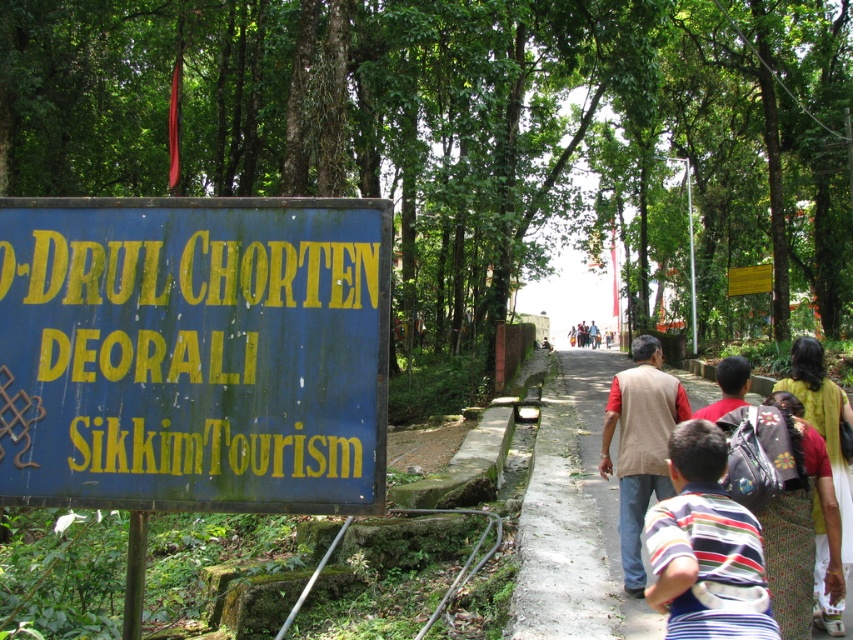
Measure the distance between point (281,436) and camera.

Point (281,436) and camera are 2.80 meters apart.

Between blue painted signboard at left and beige cotton vest at center, which one is positioned higher?

Positioned higher is blue painted signboard at left.

This screenshot has height=640, width=853. In order to click on blue painted signboard at left in this screenshot , I will do `click(193, 353)`.

Is the position of concrete at center more distant than that of yellow cotton saree at right?

Yes, it is.

Does point (520, 596) lie behind point (817, 545)?

Yes.

Locate an element on the screen. The height and width of the screenshot is (640, 853). concrete at center is located at coordinates (573, 516).

Is yellow cotton saree at right positioned behind light blue shirt at center?

No, yellow cotton saree at right is in front of light blue shirt at center.

Is yellow cotton saree at right below light blue shirt at center?

Actually, yellow cotton saree at right is above light blue shirt at center.

The height and width of the screenshot is (640, 853). Find the location of `yellow cotton saree at right`. yellow cotton saree at right is located at coordinates coord(822,422).

The image size is (853, 640). I want to click on yellow cotton saree at right, so click(822, 422).